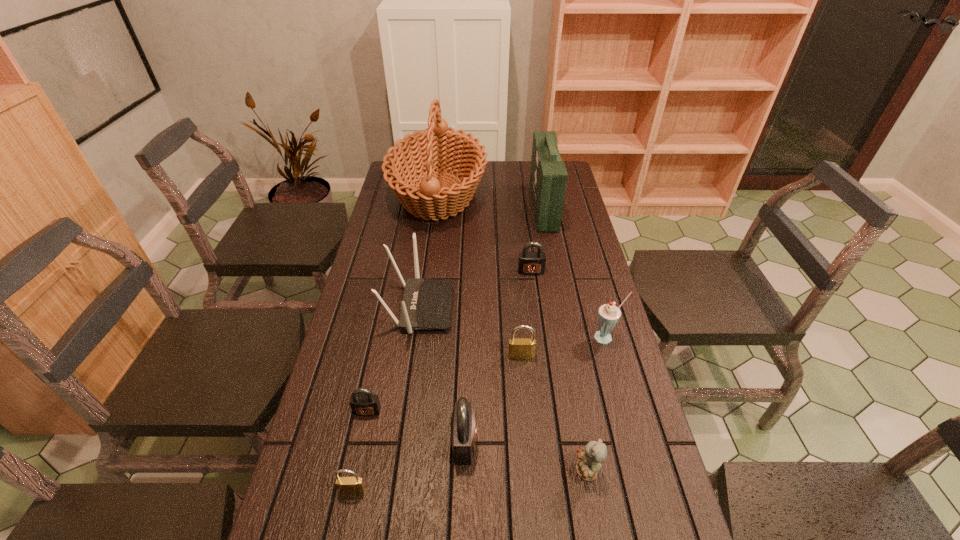
This screenshot has height=540, width=960. I want to click on vacant space located 0.060m on the front-facing side of the second tallest object, so point(517,207).

Where is `vacant region located on the front-facing side of the router`? Image resolution: width=960 pixels, height=540 pixels. vacant region located on the front-facing side of the router is located at coordinates (565, 308).

Image resolution: width=960 pixels, height=540 pixels. I want to click on free space located on the straw side of the white milkshake, so click(x=615, y=369).

You are a GUI agent. You are given a task and a screenshot of the screen. Output one action in this format:
    pyautogui.click(x=<x>, y=<y>)
    Task: Click on the free space located on the front of the tallest padlock near the keyhole
    This screenshot has width=960, height=540.
    Given the screenshot: What is the action you would take?
    pyautogui.click(x=590, y=443)

At what (x,y) coordinates should I click in order to perform the action: click on free space located 0.110m on the front of the rightmost gray padlock near the keyhole. Please return your answer as a coordinate pair (x, y). This screenshot has width=960, height=540. Looking at the image, I should click on (535, 300).

The image size is (960, 540). Identify the location of free location located on the front-facing side of the farther brass padlock. (528, 440).

This screenshot has width=960, height=540. I want to click on free space located on the front-facing side of the blue teddy bear, so click(473, 472).

Locate an element on the screen. This screenshot has height=540, width=960. free space located on the front-facing side of the blue teddy bear is located at coordinates (413, 472).

The width and height of the screenshot is (960, 540). In order to click on vacant space located on the front-facing side of the blue teddy bear in this screenshot , I will do `click(450, 472)`.

Locate an element on the screen. The height and width of the screenshot is (540, 960). vacant point located 0.240m on the front of the third nearest padlock near the keyhole is located at coordinates (x=343, y=526).